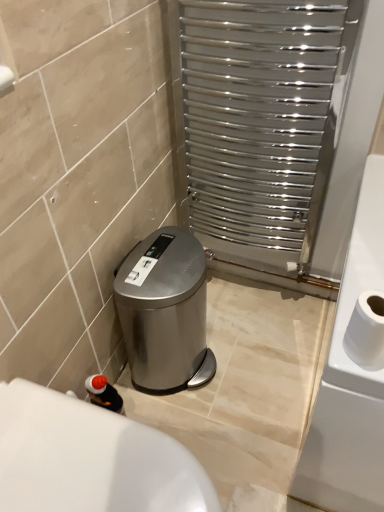
The image size is (384, 512). Describe the element at coordinates (90, 458) in the screenshot. I see `white glossy bath at lower left` at that location.

Describe the element at coordinates (265, 124) in the screenshot. I see `polished stainless steel radiator at upper right` at that location.

This screenshot has width=384, height=512. Identify the location of satin silver trash can at lower left. (165, 311).

What's the angular difference between polished stainless steel radiator at upper right and satin silver trash can at lower left's facing directions?

90.3 degrees separate the facing orientations of polished stainless steel radiator at upper right and satin silver trash can at lower left.

Is satin silver trash can at lower left at the back of polished stainless steel radiator at upper right?

No.

Considering the sizes of objects polished stainless steel radiator at upper right and satin silver trash can at lower left in the image provided, who is thinner, polished stainless steel radiator at upper right or satin silver trash can at lower left?

With smaller width is polished stainless steel radiator at upper right.

Locate an element on the screen. The width and height of the screenshot is (384, 512). waste container lying on the left of polished stainless steel radiator at upper right is located at coordinates (165, 311).

Is the position of white glossy bath at lower left more distant than that of satin silver trash can at lower left?

No, white glossy bath at lower left is closer to the camera.

Which is behind, point (44, 390) or point (200, 272)?

The point (200, 272) is behind.

From the image's perspective, between white glossy bath at lower left and satin silver trash can at lower left, who is located below?

white glossy bath at lower left.

Can you tell me how much white glossy bath at lower left and satin silver trash can at lower left differ in facing direction?

white glossy bath at lower left and satin silver trash can at lower left are facing 0.77 degrees away from each other.

Could you tell me if white matte toilet paper at right is facing polished stainless steel radiator at upper right?

No, white matte toilet paper at right is not aimed at polished stainless steel radiator at upper right.

Who is bigger, white matte toilet paper at right or polished stainless steel radiator at upper right?

With larger size is polished stainless steel radiator at upper right.

Between white matte toilet paper at right and polished stainless steel radiator at upper right, which one has less height?

white matte toilet paper at right.

Which is correct: white matte toilet paper at right is inside polished stainless steel radiator at upper right, or outside of it?

white matte toilet paper at right is outside polished stainless steel radiator at upper right.

Does point (170, 355) come in front of point (25, 421)?

That is False.

From a real-world perspective, which is physically below, satin silver trash can at lower left or white glossy bath at lower left?

From a 3D spatial view, satin silver trash can at lower left is below.

Visually, is satin silver trash can at lower left positioned to the left or to the right of white glossy bath at lower left?

In the image, satin silver trash can at lower left appears on the right side of white glossy bath at lower left.

Can you tell me how much satin silver trash can at lower left and white glossy bath at lower left differ in facing direction?

satin silver trash can at lower left and white glossy bath at lower left are facing 0.77 degrees away from each other.

Can you see polished stainless steel radiator at upper right touching white glossy bath at lower left?

polished stainless steel radiator at upper right and white glossy bath at lower left are clearly separated.

From the image's perspective, would you say polished stainless steel radiator at upper right is positioned over white glossy bath at lower left?

Yes, from the image's perspective, polished stainless steel radiator at upper right is over white glossy bath at lower left.

Based on the photo, is polished stainless steel radiator at upper right spatially inside white glossy bath at lower left, or outside of it?

polished stainless steel radiator at upper right cannot be found inside white glossy bath at lower left.

Considering the points (235, 42) and (52, 397), which point is in front, point (235, 42) or point (52, 397)?

The point (52, 397) is closer.

Can you tell me how much polished stainless steel radiator at upper right and white matte toilet paper at right differ in facing direction?

polished stainless steel radiator at upper right and white matte toilet paper at right are facing 0.272 degrees away from each other.

Looking at this image, from a real-world perspective, is polished stainless steel radiator at upper right positioned under white matte toilet paper at right based on gravity?

Yes, from a real-world perspective, polished stainless steel radiator at upper right is below white matte toilet paper at right.

Is white matte toilet paper at right inside polished stainless steel radiator at upper right?

Actually, white matte toilet paper at right is outside polished stainless steel radiator at upper right.

Looking at this image, which object is closer to the camera taking this photo, polished stainless steel radiator at upper right or white matte toilet paper at right?

white matte toilet paper at right.

Would you say white glossy bath at lower left is part of white matte toilet paper at right's contents?

No, white matte toilet paper at right does not contain white glossy bath at lower left.

Which of these two, white matte toilet paper at right or white glossy bath at lower left, stands shorter?

With less height is white matte toilet paper at right.

Is white matte toilet paper at right bigger or smaller than white glossy bath at lower left?

Considering their sizes, white matte toilet paper at right takes up less space than white glossy bath at lower left.

Looking at this image, from a real-world perspective, which is physically above, white matte toilet paper at right or white glossy bath at lower left?

From a 3D spatial view, white matte toilet paper at right is above.

Where is `waste container below the polished stainless steel radiator at upper right (from the image's perspective)`? The width and height of the screenshot is (384, 512). waste container below the polished stainless steel radiator at upper right (from the image's perspective) is located at coordinates (165, 311).

Image resolution: width=384 pixels, height=512 pixels. What are the coordinates of `waste container to the right of white glossy bath at lower left` in the screenshot? It's located at (165, 311).

Based on their spatial positions, is polished stainless steel radiator at upper right or white matte toilet paper at right further from white glossy bath at lower left?

Based on the image, polished stainless steel radiator at upper right appears to be further to white glossy bath at lower left.

From the image, which object appears to be nearer to polished stainless steel radiator at upper right, satin silver trash can at lower left or white matte toilet paper at right?

The object closer to polished stainless steel radiator at upper right is satin silver trash can at lower left.

From the image, which object appears to be farther from satin silver trash can at lower left, polished stainless steel radiator at upper right or white glossy bath at lower left?

white glossy bath at lower left is positioned further to the anchor satin silver trash can at lower left.

Considering their positions, is white matte toilet paper at right positioned further to satin silver trash can at lower left than white glossy bath at lower left?

white matte toilet paper at right.

Looking at this image, estimate the real-world distances between objects in this image. Which object is closer to white matte toilet paper at right, white glossy bath at lower left or satin silver trash can at lower left?

→ white glossy bath at lower left is positioned closer to the anchor white matte toilet paper at right.

From the image, which object appears to be nearer to white matte toilet paper at right, satin silver trash can at lower left or polished stainless steel radiator at upper right?

Based on the image, satin silver trash can at lower left appears to be nearer to white matte toilet paper at right.

When comparing their distances from satin silver trash can at lower left, does white glossy bath at lower left or polished stainless steel radiator at upper right seem closer?

polished stainless steel radiator at upper right is closer to satin silver trash can at lower left.

In the scene shown: From the image, which object appears to be farther from polished stainless steel radiator at upper right, white matte toilet paper at right or white glossy bath at lower left?

Among the two, white glossy bath at lower left is located further to polished stainless steel radiator at upper right.

Image resolution: width=384 pixels, height=512 pixels. Find the location of `toilet paper between polished stainless steel radiator at upper right and satin silver trash can at lower left in the up-down direction`. toilet paper between polished stainless steel radiator at upper right and satin silver trash can at lower left in the up-down direction is located at coordinates (366, 331).

This screenshot has height=512, width=384. I want to click on toilet paper between polished stainless steel radiator at upper right and white glossy bath at lower left in the vertical direction, so (366, 331).

What are the coordinates of `waste container between white glossy bath at lower left and white matte toilet paper at right from left to right` in the screenshot? It's located at (165, 311).

You are a GUI agent. You are given a task and a screenshot of the screen. Output one action in this format:
    pyautogui.click(x=<x>, y=<y>)
    Task: Click on the waste container between polished stainless steel radiator at upper right and white glossy bath at lower left from top to bottom
    This screenshot has height=512, width=384.
    Given the screenshot: What is the action you would take?
    pyautogui.click(x=165, y=311)